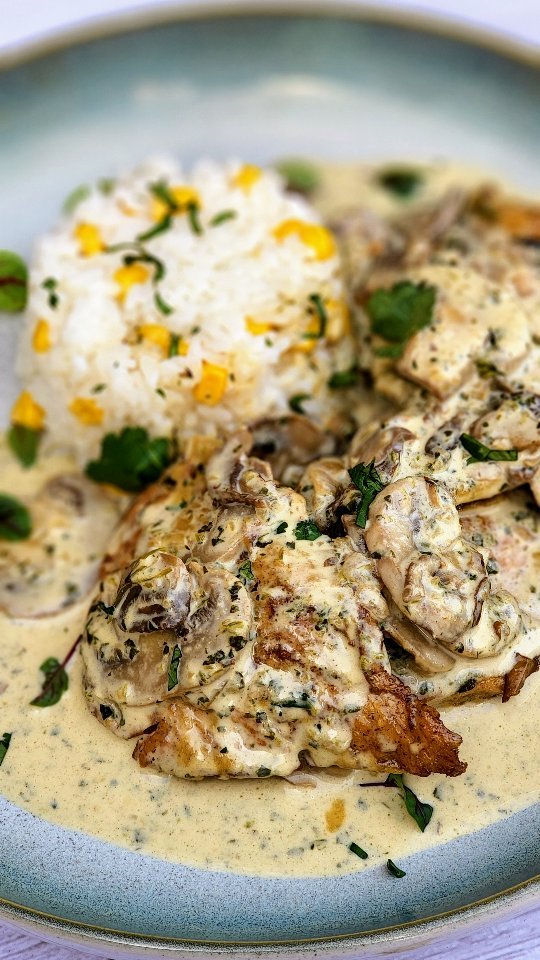
Identify the location of plate. The height and width of the screenshot is (960, 540). (249, 908).